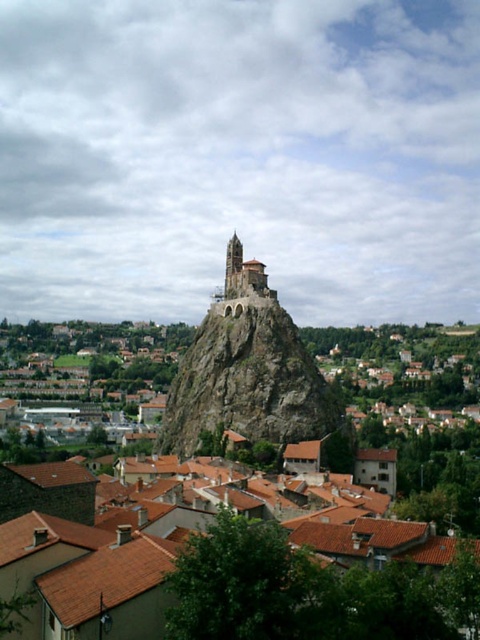
Can you confirm if brown tiled roofs at center is taller than smooth stone tower at center?

Indeed, brown tiled roofs at center has a greater height compared to smooth stone tower at center.

Is point (203, 513) in front of point (238, 259)?

That is True.

The width and height of the screenshot is (480, 640). What do you see at coordinates (260, 586) in the screenshot?
I see `brown tiled roofs at center` at bounding box center [260, 586].

Image resolution: width=480 pixels, height=640 pixels. In order to click on brown tiled roofs at center in this screenshot , I will do `click(260, 586)`.

Which is behind, point (243, 282) or point (225, 275)?

The point (225, 275) is more distant.

Is rocky cliff at center closer to camera compared to smooth stone tower at center?

Yes, it is in front of smooth stone tower at center.

What do you see at coordinates (248, 376) in the screenshot? I see `rocky cliff at center` at bounding box center [248, 376].

Locate an element on the screen. rocky cliff at center is located at coordinates (248, 376).

Is brown tiled roofs at center shorter than rocky cliff at center?

Indeed, brown tiled roofs at center has a lesser height compared to rocky cliff at center.

Between brown tiled roofs at center and rocky cliff at center, which one has less height?

With less height is brown tiled roofs at center.

Which is in front, point (296, 536) or point (280, 352)?

Point (296, 536) is in front.

Find the location of a particular element. The image size is (480, 640). brown tiled roofs at center is located at coordinates (260, 586).